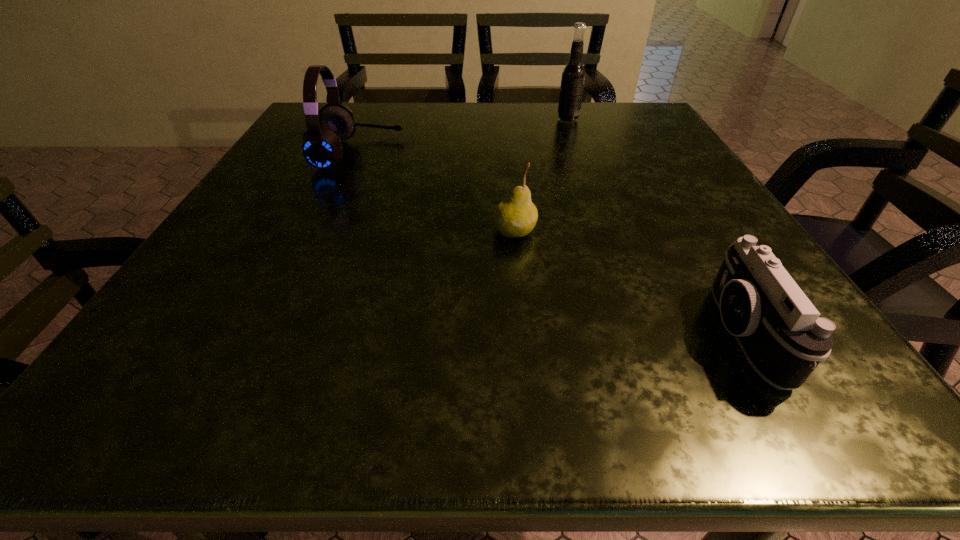
You are a GUI agent. You are given a task and a screenshot of the screen. Output one action in this format:
    pyautogui.click(x=<x>, y=<y>)
    Task: Click on the root beer
    This screenshot has width=960, height=540.
    Given the screenshot: What is the action you would take?
    pyautogui.click(x=573, y=76)

Image resolution: width=960 pixels, height=540 pixels. Identify the location of the tallest object. (573, 76).

Identify the location of the third nearest object. The image size is (960, 540). (321, 143).

Find the location of a particular element. This screenshot has width=960, height=540. the third shortest object is located at coordinates (321, 143).

Where is `pear`? Image resolution: width=960 pixels, height=540 pixels. pear is located at coordinates (516, 216).

The image size is (960, 540). I want to click on the third object from right to left, so click(516, 216).

Where is `the rightmost object`? the rightmost object is located at coordinates (783, 336).

Locate an element on the screen. This screenshot has width=960, height=540. the nearest object is located at coordinates (783, 336).

Locate an element on the screen. The height and width of the screenshot is (540, 960). vacant space situated on the label of the second object from right to left is located at coordinates (523, 120).

Locate an element on the screen. The width and height of the screenshot is (960, 540). free space located on the label of the second object from right to left is located at coordinates click(x=398, y=120).